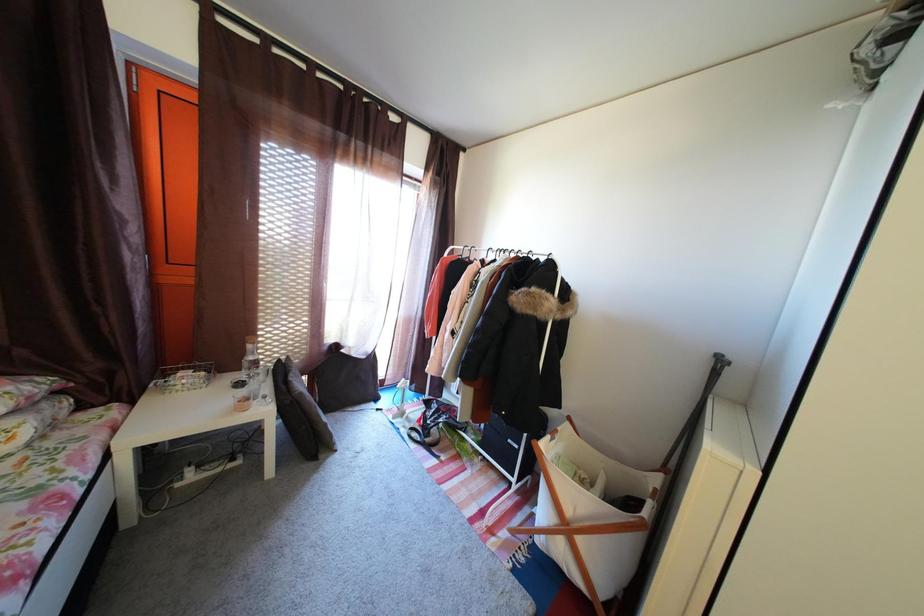
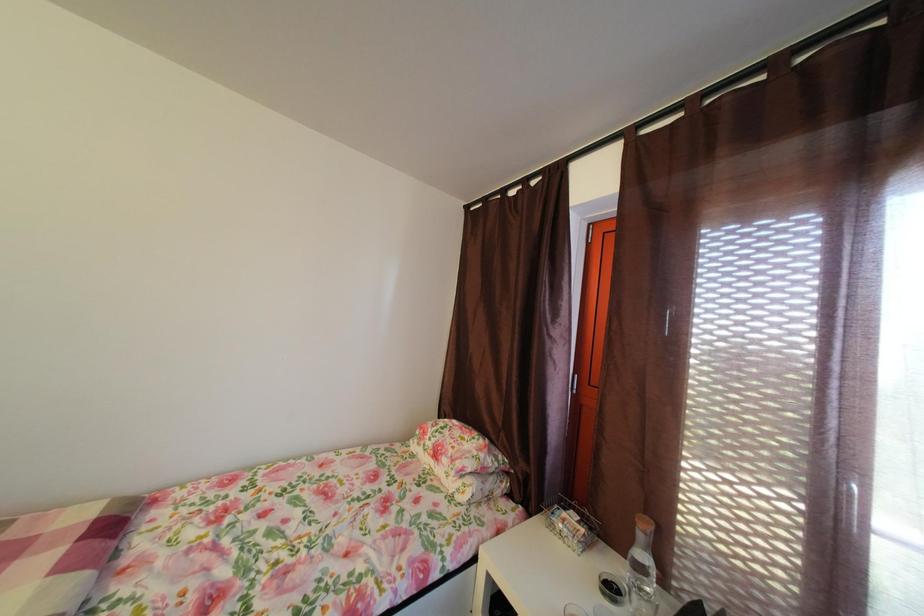
Question: The camera is either moving clockwise (left) or counter-clockwise (right) around the object. The first image is from the beginning of the video and the second image is from the end. Is the camera moving left or right when shooting the video?

Choices:
 (A) Left
 (B) Right

Answer: (B)